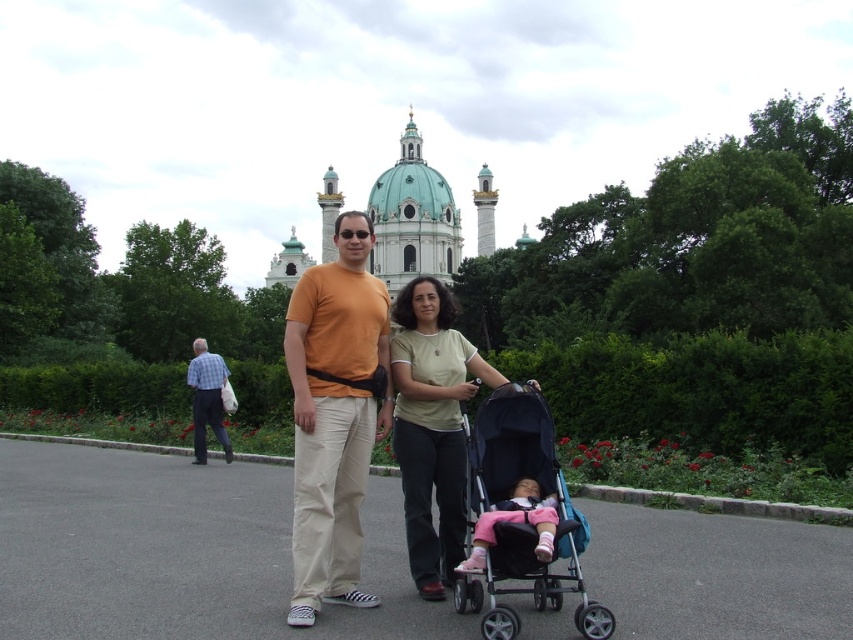
Question: Which point is closer to the camera taking this photo?

Choices:
 (A) [202, 400]
 (B) [310, 426]

Answer: (B)

Question: Among these objects, which one is nearest to the camera?

Choices:
 (A) pink fabric baby carriage at center
 (B) white marble palace at center

Answer: (A)

Question: Which object appears closest to the camera in this image?

Choices:
 (A) pink fabric baby carriage at center
 (B) light green cotton shirt at center
 (C) blue plaid shirt at left
 (D) black fabric stroller at center

Answer: (D)

Question: Does matte orange t-shirt at center have a greater width compared to blue plaid shirt at left?

Choices:
 (A) no
 (B) yes

Answer: (B)

Question: Can you confirm if pink fabric baby carriage at center is positioned to the right of blue plaid shirt at left?

Choices:
 (A) yes
 (B) no

Answer: (A)

Question: Can you confirm if light green cotton shirt at center is smaller than white marble palace at center?

Choices:
 (A) no
 (B) yes

Answer: (B)